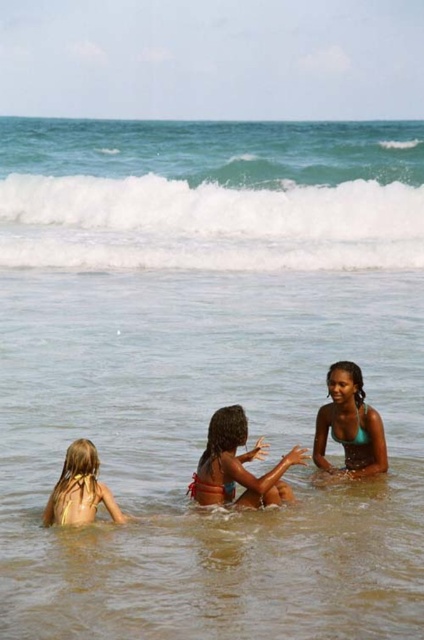
You are a lifeguard on duty and need to ensure safety between the two swimmers. The safety protocol requires at least 1.5 meters of distance between swimmers in shallow water to prevent collisions. Are the red bikini at center and teal bikini at center maintaining the required distance?

The distance between the red bikini at center and teal bikini at center is 1.30 meters, which is less than the required 1.5 meters. Therefore, they are not maintaining the required safety distance.

You are a photographer at the beach and want to capture a clear shot of both the teal bikini at center and the yellow fabric swimsuit at lower left. Given their sizes, which one should you focus on first to ensure it fits within your camera frame?

The teal bikini at center is larger in size than the yellow fabric swimsuit at lower left, so you should focus on capturing the teal bikini at center first to ensure it fits within your camera frame before adjusting for the smaller one.